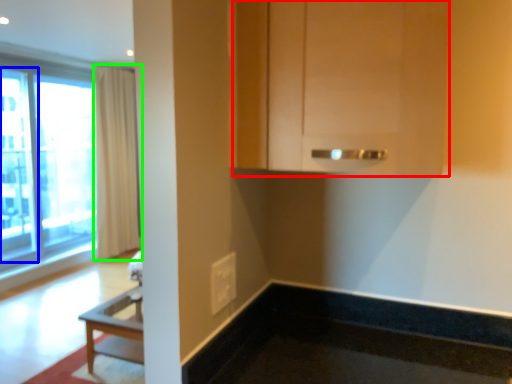
Question: Which object is positioned closest to cabinetry (highlighted by a red box)? Select from screen door (highlighted by a blue box) and curtain (highlighted by a green box).

Choices:
 (A) screen door
 (B) curtain

Answer: (A)